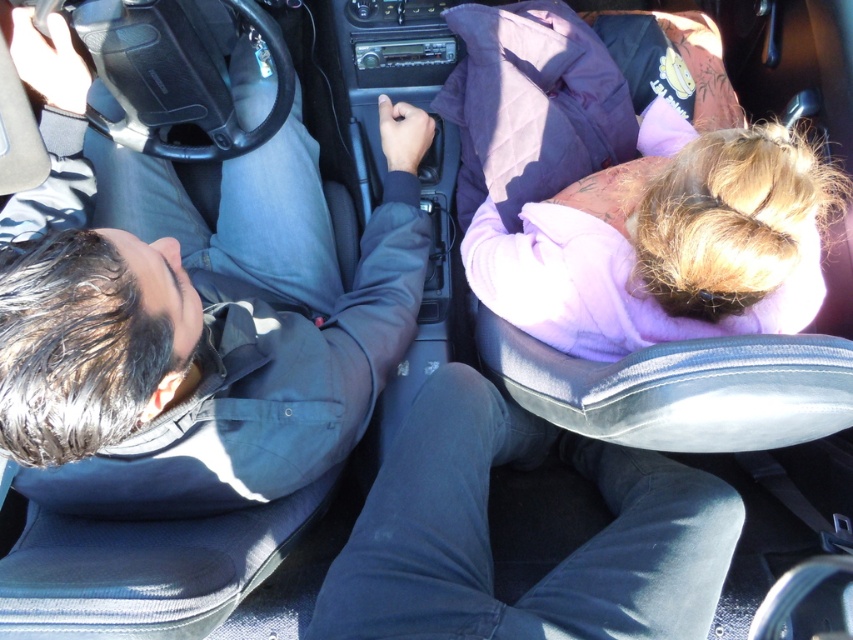
You are sitting in the back seat of the car and want to reach an object located at one of the two points. The first point is point (33, 256) and the second is point (694, 305). Which point is closer to you?

Point (33, 256) is closer to the camera than point (694, 305), so the object at point (33, 256) is closer to you.

You are a passenger in the car and want to hand a toy to the driver wearing the dark blue shirt at center. The toy is on the purple fleece jacket at upper right. Which direction should you move the toy to reach the driver?

The dark blue shirt at center is on the left side of the purple fleece jacket at upper right. To reach the driver, you should move the toy from the purple fleece jacket at upper right to the left towards the dark blue shirt at center.